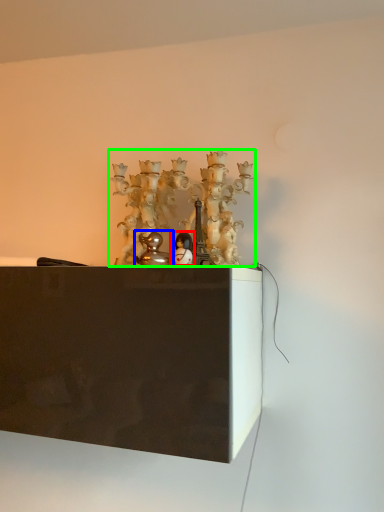
Question: Estimate the real-world distances between objects in this image. Which object is farther from toy (highlighted by a red box), toy (highlighted by a blue box) or art (highlighted by a green box)?

Choices:
 (A) toy
 (B) art

Answer: (B)